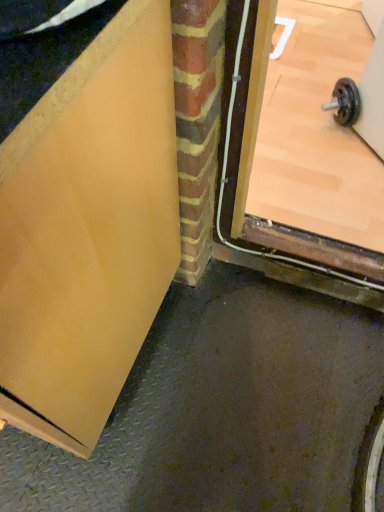
Question: Is matte wood door at center, the 1th door when ordered from right to left, in front of or behind matte yellow door at upper left, the 2th door in the right-to-left sequence, in the image?

Choices:
 (A) front
 (B) behind

Answer: (B)

Question: From a real-world perspective, is matte wood door at center, the second door when ordered from front to back, above or below matte yellow door at upper left, which is counted as the first door, starting from the front?

Choices:
 (A) below
 (B) above

Answer: (A)

Question: In terms of height, does matte wood door at center, the 2th door when ordered from left to right, look taller or shorter compared to matte yellow door at upper left, the 2th door in the right-to-left sequence?

Choices:
 (A) tall
 (B) short

Answer: (B)

Question: Based on their positions, is matte yellow door at upper left, which is the 2th door from back to front, located to the left or right of matte wood door at center, the 1th door when ordered from right to left?

Choices:
 (A) right
 (B) left

Answer: (B)

Question: Choose the correct answer: Is matte yellow door at upper left, which is the first door in left-to-right order, inside matte wood door at center, the 2th door when ordered from left to right, or outside it?

Choices:
 (A) outside
 (B) inside

Answer: (A)

Question: Considering the positions of matte yellow door at upper left, the 2th door in the right-to-left sequence, and matte wood door at center, the 1th door when ordered from right to left, in the image, is matte yellow door at upper left, the 2th door in the right-to-left sequence, taller or shorter than matte wood door at center, the 1th door when ordered from right to left,?

Choices:
 (A) tall
 (B) short

Answer: (A)

Question: Is point (102, 220) closer or farther from the camera than point (294, 236)?

Choices:
 (A) farther
 (B) closer

Answer: (B)